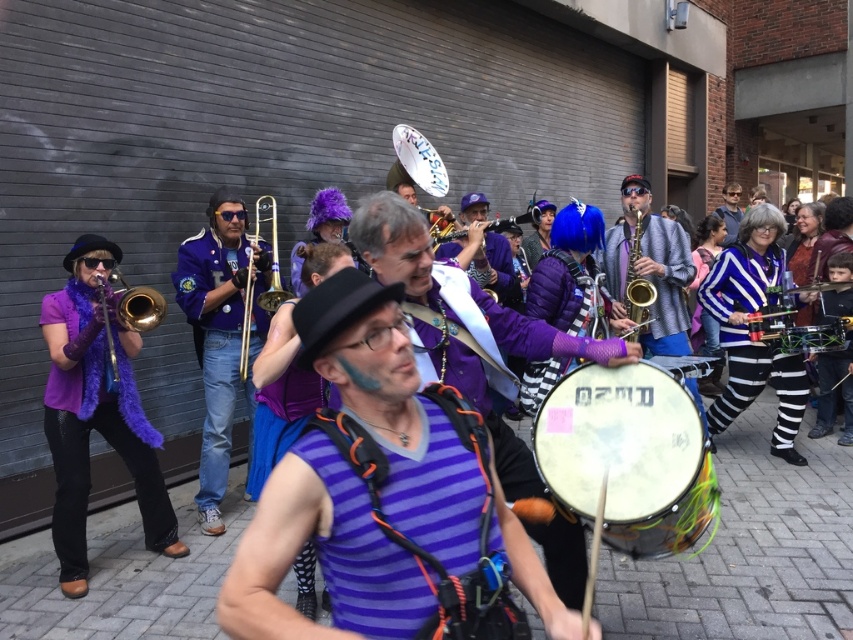
Question: Which object is the closest to the satin gold saxophone at center?

Choices:
 (A) matte purple shirt at center
 (B) matte purple scarf at left

Answer: (B)

Question: Is white drum at center below matte purple scarf at left?

Choices:
 (A) no
 (B) yes

Answer: (B)

Question: Can you confirm if matte purple scarf at left is thinner than shiny metallic drum at center?

Choices:
 (A) no
 (B) yes

Answer: (A)

Question: Is satin gold saxophone at center further to camera compared to gold brass trumpet at center?

Choices:
 (A) yes
 (B) no

Answer: (A)

Question: Among these points, which one is farthest from the camera?

Choices:
 (A) (635, 211)
 (B) (740, 332)
 (C) (207, 422)
 (D) (132, 328)

Answer: (A)

Question: Which of the following is the closest to the observer?

Choices:
 (A) (791, 426)
 (B) (636, 250)
 (C) (463, 340)
 (D) (115, 269)

Answer: (C)